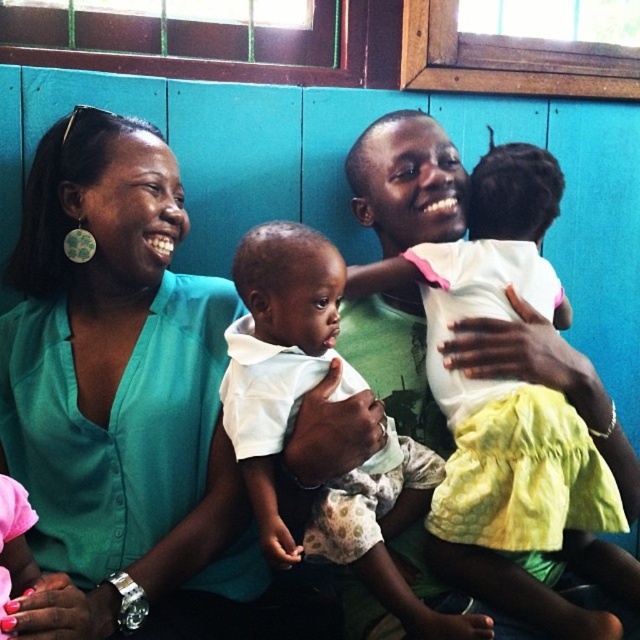
Who is positioned more to the right, teal shirt at left or white matte dress at center?

white matte dress at center is more to the right.

Does point (16, 259) lie behind point (560, 385)?

Yes, point (16, 259) is behind point (560, 385).

In order to click on teal shirt at left in this screenshot , I will do coord(118,392).

Which is more to the right, teal shirt at left or white soft fabric baby at center?

white soft fabric baby at center

Between teal shirt at left and white soft fabric baby at center, which one appears on the left side from the viewer's perspective?

From the viewer's perspective, teal shirt at left appears more on the left side.

You are a GUI agent. You are given a task and a screenshot of the screen. Output one action in this format:
    pyautogui.click(x=<x>, y=<y>)
    Task: Click on the teal shirt at left
    The width and height of the screenshot is (640, 640).
    Given the screenshot: What is the action you would take?
    pyautogui.click(x=118, y=392)

This screenshot has height=640, width=640. Find the location of `teal shirt at left`. teal shirt at left is located at coordinates (118, 392).

Which is below, white soft fabric baby at center or white matte dress at center?

Positioned lower is white soft fabric baby at center.

Does white soft fabric baby at center appear on the right side of white matte dress at center?

Incorrect, white soft fabric baby at center is not on the right side of white matte dress at center.

You are a GUI agent. You are given a task and a screenshot of the screen. Output one action in this format:
    pyautogui.click(x=<x>, y=<y>)
    Task: Click on the white soft fabric baby at center
    This screenshot has height=640, width=640.
    Given the screenshot: What is the action you would take?
    pyautogui.click(x=291, y=413)